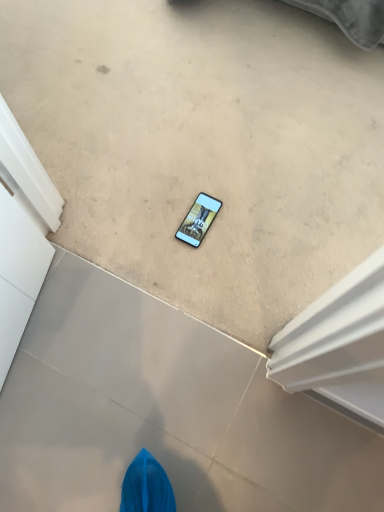
Question: Is beige carpet at center, acting as the 1th concrete starting from the top, thinner than matte gray concrete at center, the first concrete ordered from the bottom?

Choices:
 (A) no
 (B) yes

Answer: (A)

Question: Is beige carpet at center, which is the second concrete from bottom to top, further to the viewer compared to matte gray concrete at center, the 2th concrete in the top-to-bottom sequence?

Choices:
 (A) no
 (B) yes

Answer: (B)

Question: Is beige carpet at center, which is the second concrete from bottom to top, to the right of matte gray concrete at center, the first concrete ordered from the bottom, from the viewer's perspective?

Choices:
 (A) no
 (B) yes

Answer: (B)

Question: From a real-world perspective, is beige carpet at center, acting as the 1th concrete starting from the top, physically below matte gray concrete at center, the first concrete ordered from the bottom?

Choices:
 (A) no
 (B) yes

Answer: (A)

Question: Is beige carpet at center, acting as the 1th concrete starting from the top, with matte gray concrete at center, the first concrete ordered from the bottom?

Choices:
 (A) no
 (B) yes

Answer: (A)

Question: From the image's perspective, is matte black phone at center located above or below matte gray concrete at center, the first concrete ordered from the bottom?

Choices:
 (A) above
 (B) below

Answer: (A)

Question: Considering the positions of point (203, 202) and point (347, 503), is point (203, 202) closer or farther from the camera than point (347, 503)?

Choices:
 (A) closer
 (B) farther

Answer: (B)

Question: Looking at the image, does matte black phone at center seem bigger or smaller compared to matte gray concrete at center, the first concrete ordered from the bottom?

Choices:
 (A) big
 (B) small

Answer: (B)

Question: In terms of width, does matte black phone at center look wider or thinner when compared to matte gray concrete at center, the 2th concrete in the top-to-bottom sequence?

Choices:
 (A) thin
 (B) wide

Answer: (A)

Question: Considering the positions of matte gray concrete at center, the 2th concrete in the top-to-bottom sequence, and matte black phone at center in the image, is matte gray concrete at center, the 2th concrete in the top-to-bottom sequence, taller or shorter than matte black phone at center?

Choices:
 (A) tall
 (B) short

Answer: (A)

Question: Is matte gray concrete at center, the first concrete ordered from the bottom, inside or outside of matte black phone at center?

Choices:
 (A) inside
 (B) outside

Answer: (B)

Question: Looking at their shapes, would you say matte gray concrete at center, the first concrete ordered from the bottom, is wider or thinner than matte black phone at center?

Choices:
 (A) wide
 (B) thin

Answer: (A)

Question: From the image's perspective, is matte gray concrete at center, the 2th concrete in the top-to-bottom sequence, located above or below matte black phone at center?

Choices:
 (A) above
 (B) below

Answer: (B)

Question: Is matte black phone at center inside the boundaries of beige carpet at center, acting as the 1th concrete starting from the top, or outside?

Choices:
 (A) outside
 (B) inside

Answer: (B)

Question: From a real-world perspective, is matte black phone at center physically located above or below beige carpet at center, acting as the 1th concrete starting from the top?

Choices:
 (A) above
 (B) below

Answer: (B)